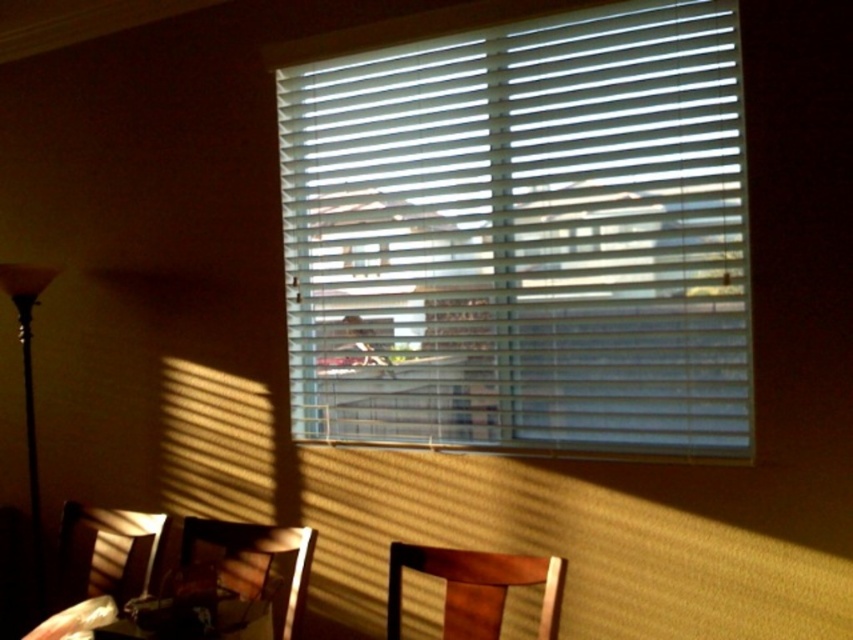
Describe the element at coordinates (474, 588) in the screenshot. I see `wooden chair at lower center` at that location.

Which is more to the right, wooden chair at lower center or black glass floor lamp at left?

Positioned to the right is wooden chair at lower center.

Where is `wooden chair at lower center`? The image size is (853, 640). wooden chair at lower center is located at coordinates (474, 588).

Image resolution: width=853 pixels, height=640 pixels. Find the location of `wooden chair at lower center`. wooden chair at lower center is located at coordinates (474, 588).

Identify the location of white plastic blinds at upper center. (523, 236).

Looking at this image, is white plastic blinds at upper center positioned at the back of wooden armchair at lower left?

No, white plastic blinds at upper center is closer to the viewer.

Identify the location of white plastic blinds at upper center. (523, 236).

At what (x,y) coordinates should I click in order to perform the action: click on white plastic blinds at upper center. Please return your answer as a coordinate pair (x, y). This screenshot has width=853, height=640. Looking at the image, I should click on (523, 236).

The width and height of the screenshot is (853, 640). Find the location of `wooden chair at lower center`. wooden chair at lower center is located at coordinates (474, 588).

Who is more distant from viewer, (445, 621) or (65, 564)?

Point (65, 564)

Where is `wooden chair at lower center`? wooden chair at lower center is located at coordinates (474, 588).